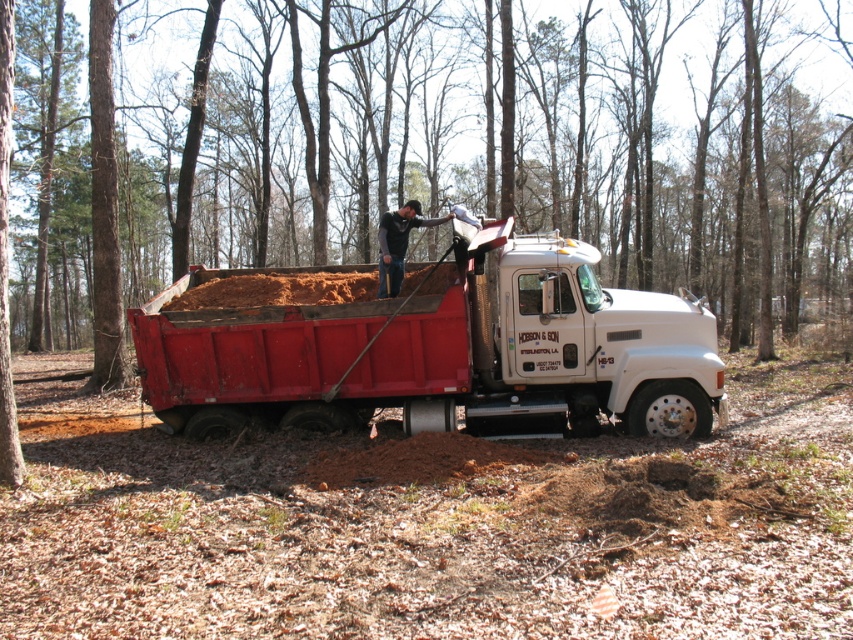
Which is above, brown bark tree at center or matte red dump truck at center?

brown bark tree at center

Which is more to the left, brown bark tree at center or matte red dump truck at center?

brown bark tree at center

Is point (70, 253) positioned behind point (541, 252)?

Yes.

Identify the location of brown bark tree at center. The image size is (853, 640). (683, 163).

Which is behind, point (602, 214) or point (387, 273)?

The point (602, 214) is more distant.

Does brown bark tree at center appear over dark gray jeans at center?

Yes.

This screenshot has height=640, width=853. What do you see at coordinates (683, 163) in the screenshot?
I see `brown bark tree at center` at bounding box center [683, 163].

The width and height of the screenshot is (853, 640). In order to click on brown bark tree at center in this screenshot , I will do `click(683, 163)`.

Does matte red dump truck at center have a lesser height compared to dark gray jeans at center?

Yes.

Does matte red dump truck at center appear on the left side of dark gray jeans at center?

Correct, you'll find matte red dump truck at center to the left of dark gray jeans at center.

Between point (233, 420) and point (405, 237), which one is positioned in front?

Point (233, 420) is more forward.

The height and width of the screenshot is (640, 853). I want to click on matte red dump truck at center, so click(440, 349).